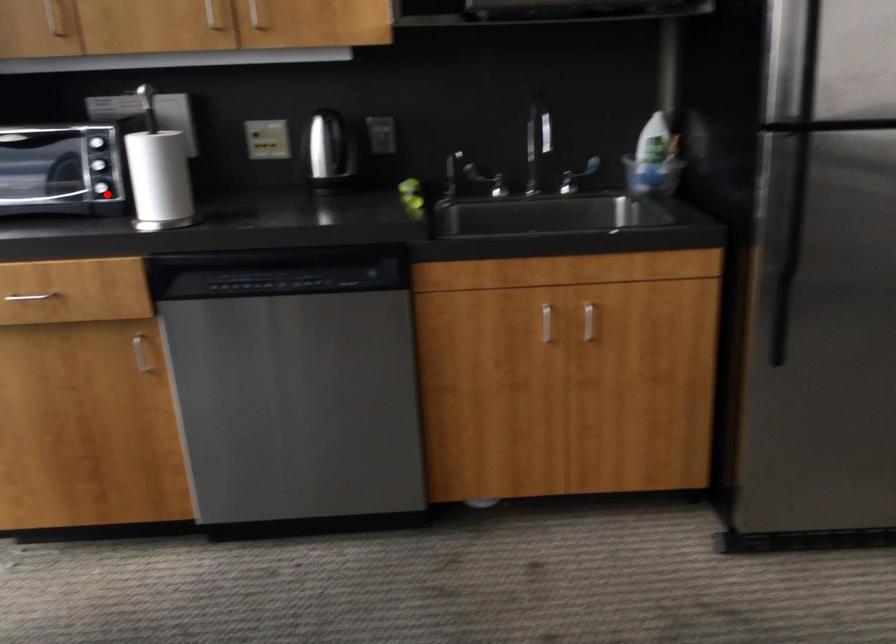
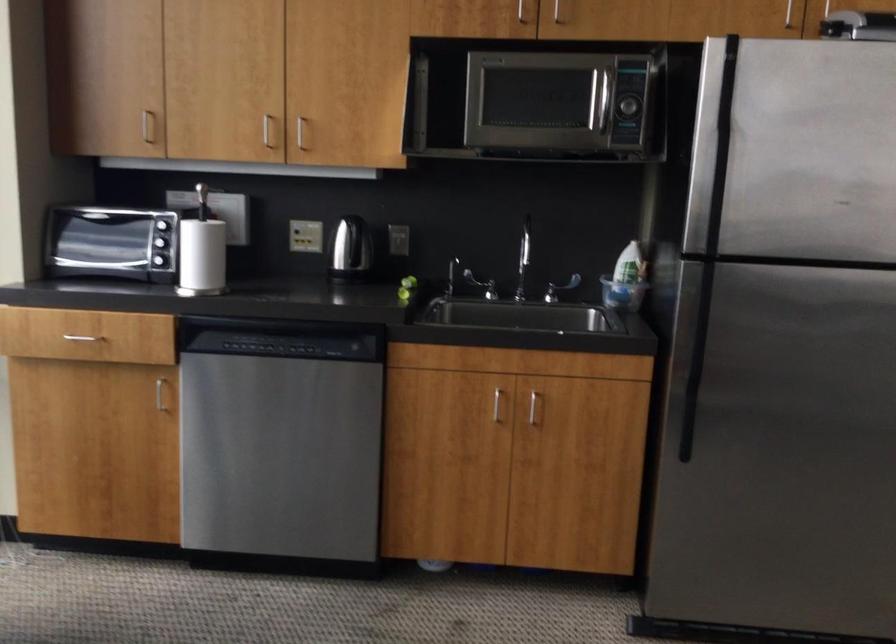
Question: I am providing you with two images of the same scene from different viewpoints. Given a red point in image1, look at the same physical point in image2. Is it:

Choices:
 (A) Closer to the viewpoint
 (B) Farther from the viewpoint

Answer: (B)